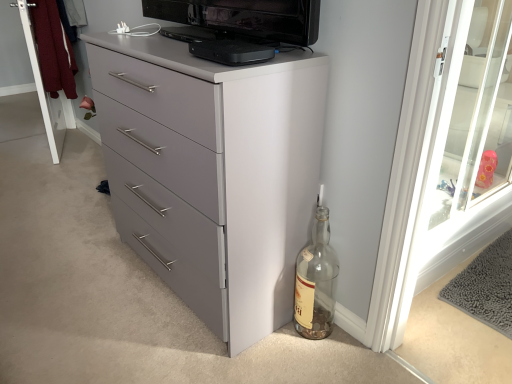
Find the location of a particular element. This screenshot has height=384, width=512. free region on the left part of matte gray chest of drawers at center is located at coordinates tap(74, 271).